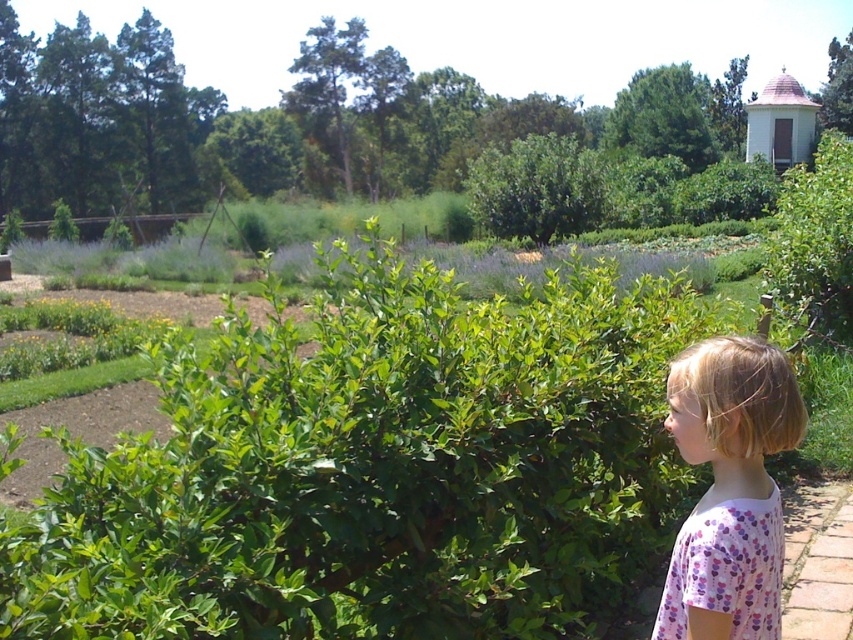
Is pink floral shirt at lower right to the right of green leafy bush at upper center from the viewer's perspective?

Correct, you'll find pink floral shirt at lower right to the right of green leafy bush at upper center.

Who is shorter, pink floral shirt at lower right or green leafy bush at upper center?

pink floral shirt at lower right

Is point (700, 432) positioned before point (289, 145)?

Yes, point (700, 432) is closer to viewer.

Locate an element on the screen. Image resolution: width=853 pixels, height=640 pixels. pink floral shirt at lower right is located at coordinates (729, 488).

Describe the element at coordinates (729, 488) in the screenshot. This screenshot has height=640, width=853. I see `pink floral shirt at lower right` at that location.

Between pink floral shirt at lower right and green leafy bush at upper right, which one is positioned lower?

pink floral shirt at lower right is below.

Who is more forward, (689,531) or (799,272)?

Point (689,531) is in front.

This screenshot has height=640, width=853. I want to click on pink floral shirt at lower right, so click(x=729, y=488).

Can you confirm if brick pavement at lower right is positioned below green leafy bush at upper center?

Indeed, brick pavement at lower right is positioned under green leafy bush at upper center.

Can you confirm if brick pavement at lower right is bigger than green leafy bush at upper center?

Incorrect, brick pavement at lower right is not larger than green leafy bush at upper center.

Where is `brick pavement at lower right`? brick pavement at lower right is located at coordinates (817, 563).

Image resolution: width=853 pixels, height=640 pixels. In order to click on brick pavement at lower right in this screenshot , I will do `click(817, 563)`.